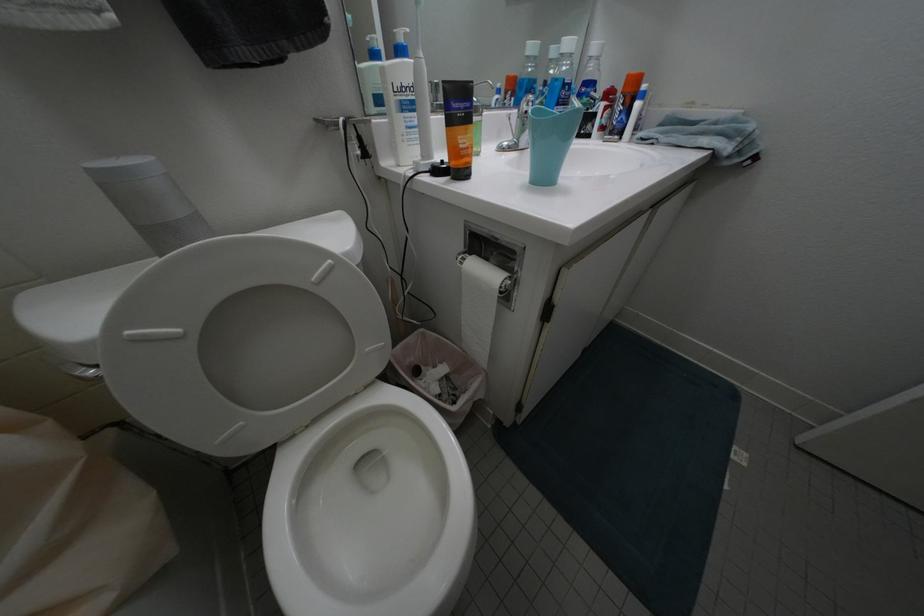
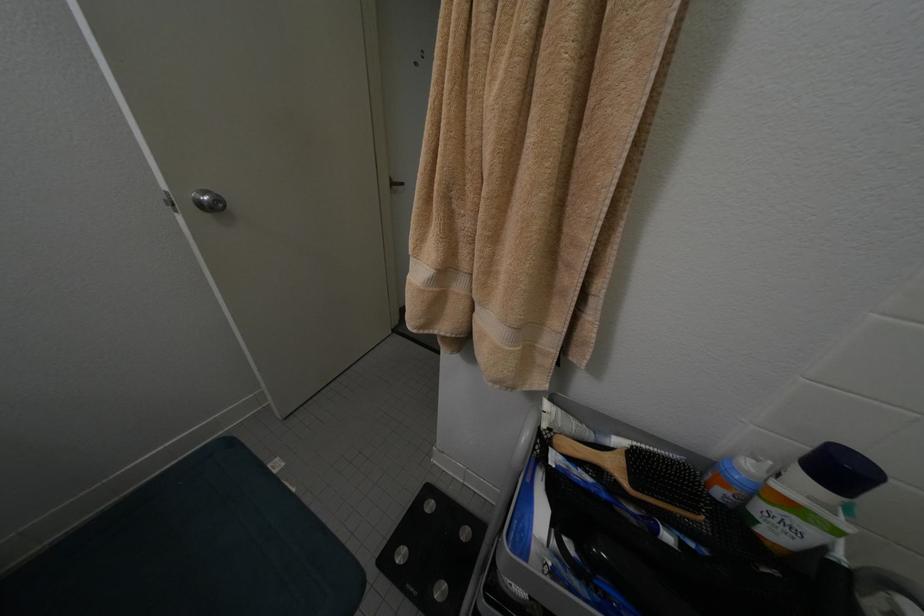
From the picture: Based on the continuous images, in which direction is the camera rotating?

The rotation direction of the camera is right-down.